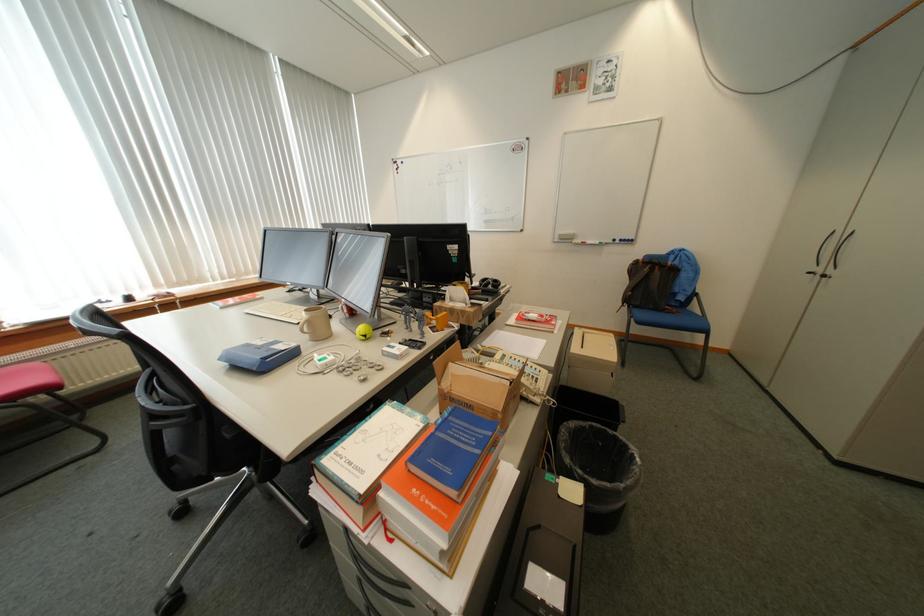
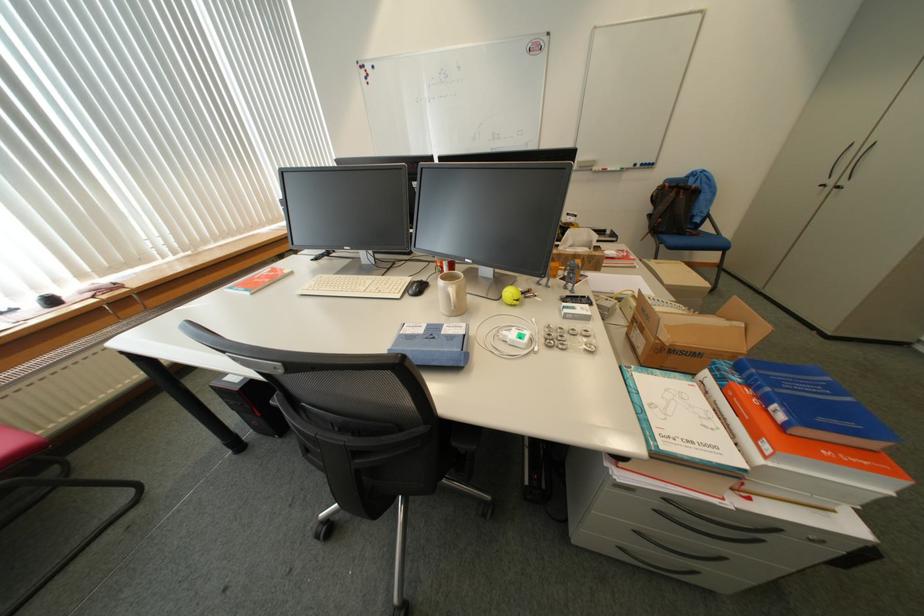
Where in the second image is the point corresponding to point 456,386 from the first image?

(675, 339)